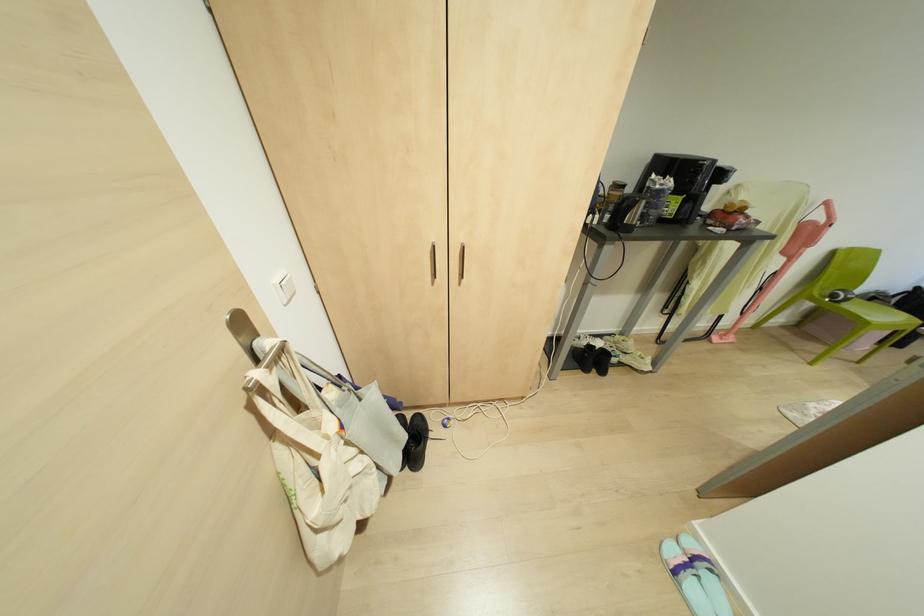
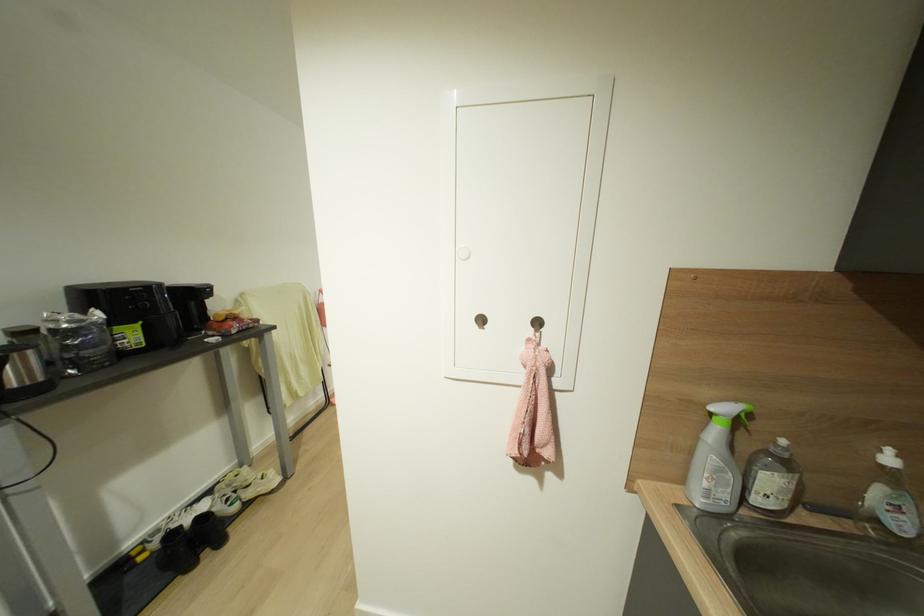
Question: I am providing you with two images of the same scene from different viewpoints. Which of the following objects are not visible in image2?

Choices:
 (A) soap dispenser pump
 (B) chair sitting surface
 (C) beige wall dial
 (D) white sneaker

Answer: (B)